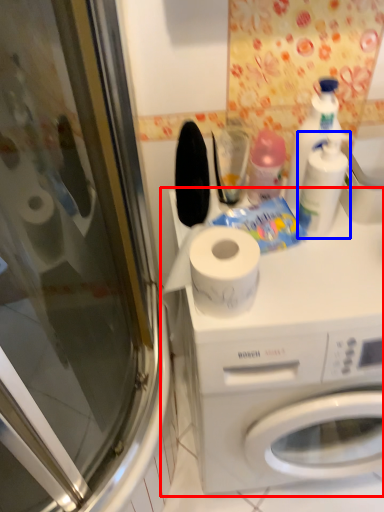
Question: Which of the following is the farthest to the observer, washing machine (highlighted by a red box) or cleaning product (highlighted by a blue box)?

Choices:
 (A) washing machine
 (B) cleaning product

Answer: (B)